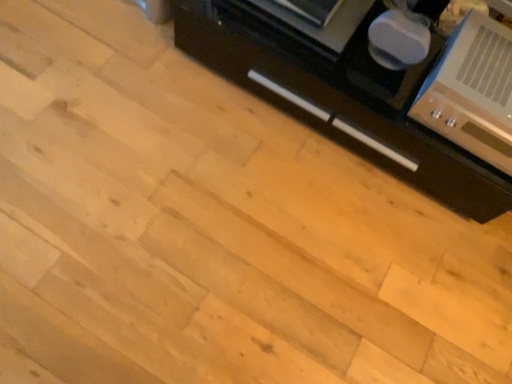
Find the location of a particular element. The width and height of the screenshot is (512, 384). vacant space that is to the left of black matte cabinet at right is located at coordinates (124, 92).